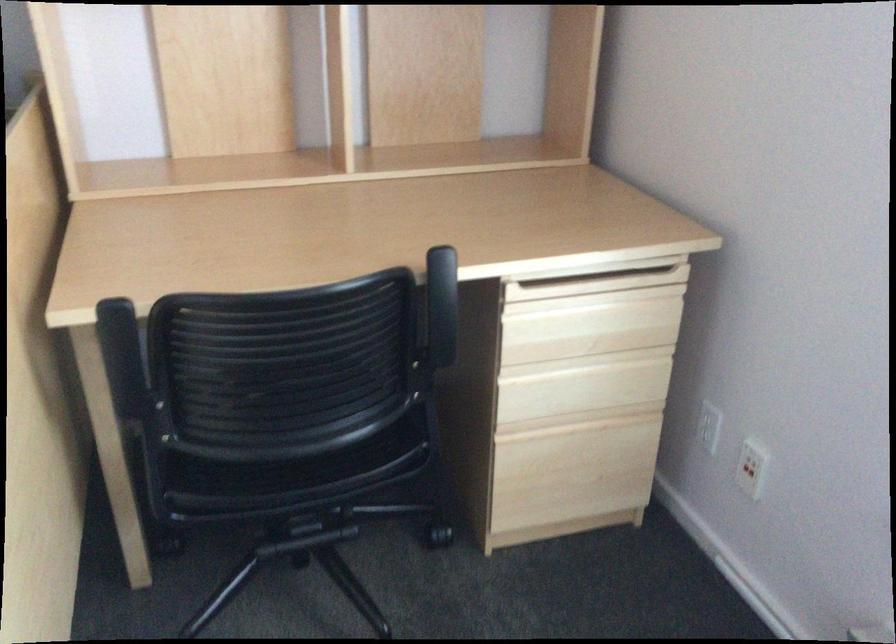
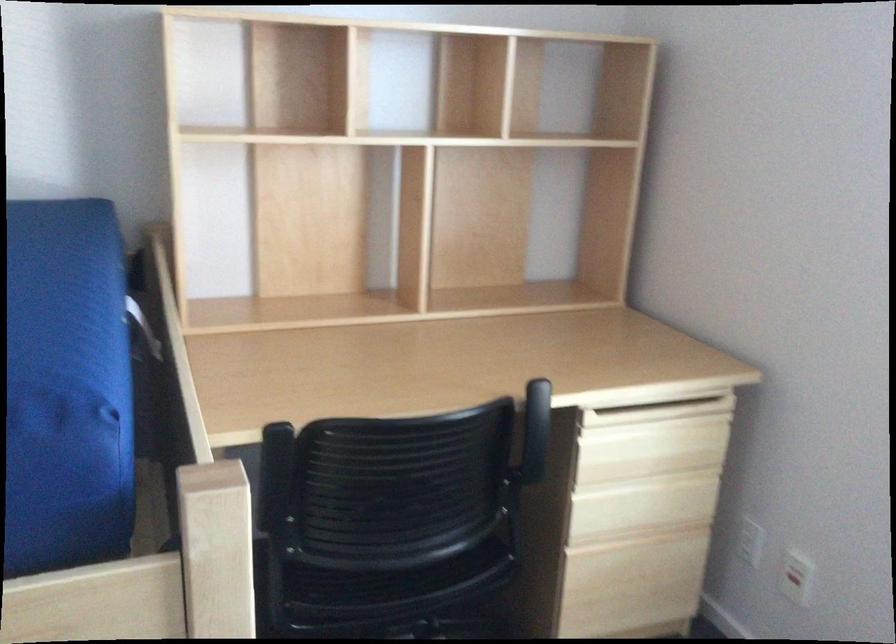
Question: The first image is from the beginning of the video and the second image is from the end. How did the camera likely rotate when shooting the video?

Choices:
 (A) Left
 (B) Right
 (C) Up
 (D) Down

Answer: (C)